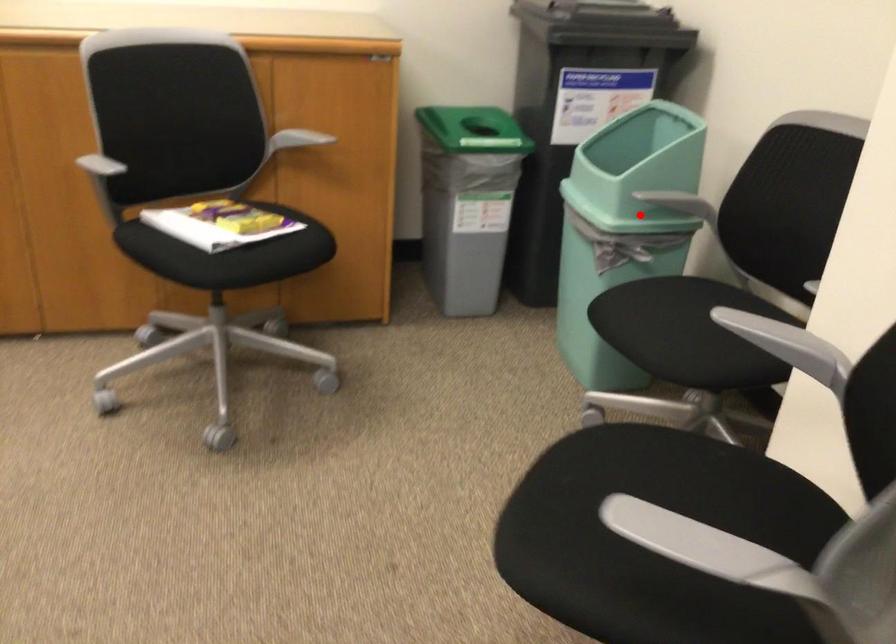
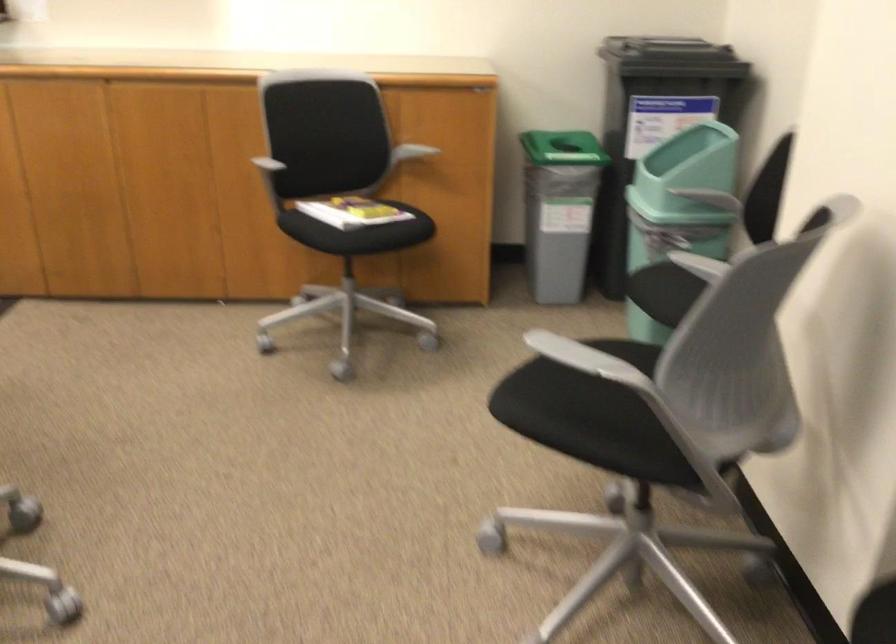
Question: I am providing you with two images of the same scene from different viewpoints. A red point is shown in image1. For the corresponding object point in image2, is it positioned nearer or farther from the camera?

Choices:
 (A) Nearer
 (B) Farther

Answer: (B)